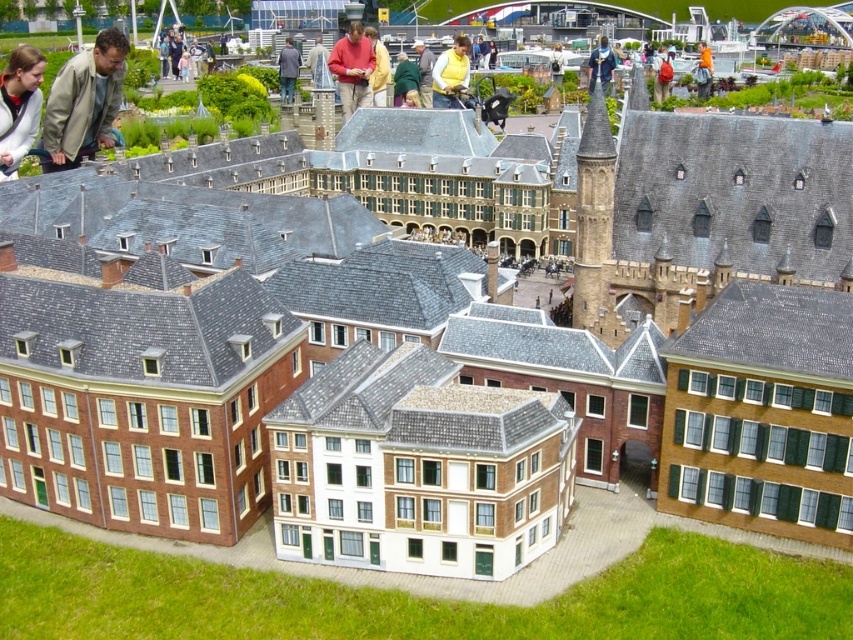
This screenshot has height=640, width=853. Describe the element at coordinates (450, 72) in the screenshot. I see `yellow matte jacket at center` at that location.

Between yellow matte jacket at center and matte gray coat at center, which one appears on the left side from the viewer's perspective?

matte gray coat at center is more to the left.

Identify the location of yellow matte jacket at center. (450, 72).

Between blue denim jacket at upper center and green wool sweater at center, which one is positioned higher?

blue denim jacket at upper center is above.

Locate an element on the screen. blue denim jacket at upper center is located at coordinates (601, 65).

Measure the distance between orange backpack at center and matte gray coat at center.

orange backpack at center and matte gray coat at center are 88.93 meters apart.

Between orange backpack at center and matte gray coat at center, which one is positioned lower?

matte gray coat at center is lower down.

This screenshot has height=640, width=853. Find the location of `orange backpack at center`. orange backpack at center is located at coordinates (660, 76).